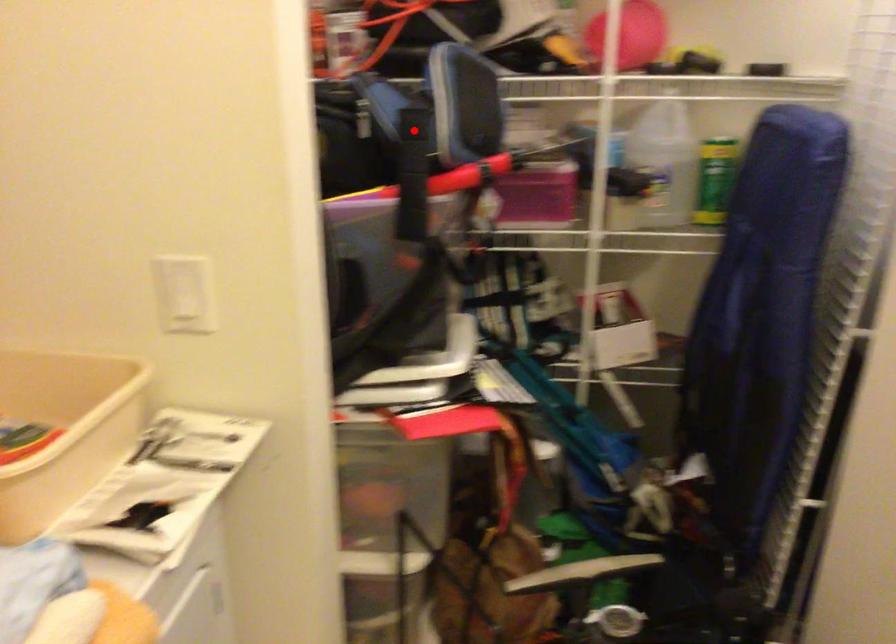
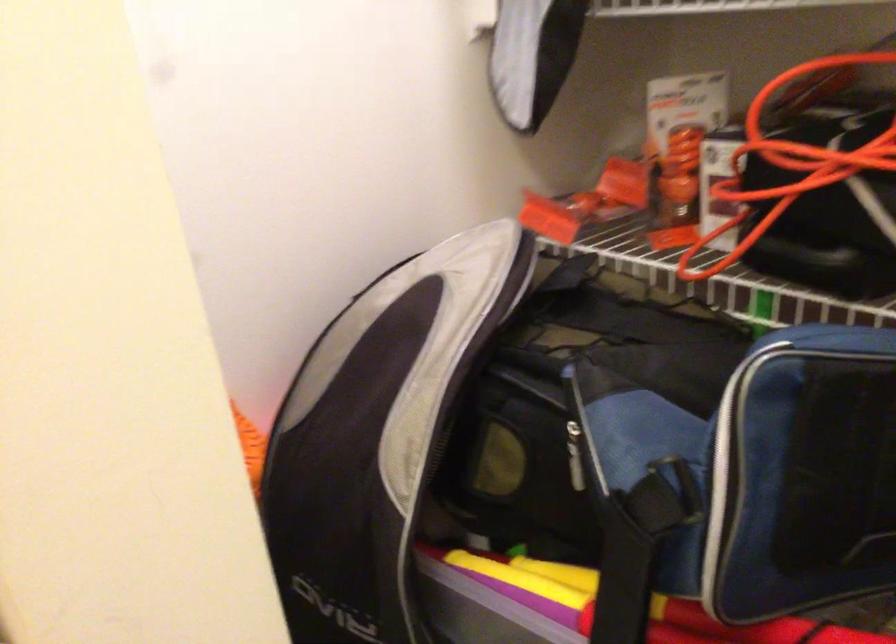
In the second image, find the point that corresponds to the highlighted location in the first image.

(622, 581)